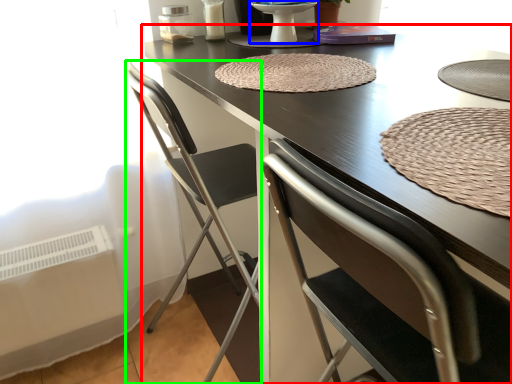
Question: Which is nearer to the table (highlighted by a red box)? round table (highlighted by a blue box) or chair (highlighted by a green box).

Choices:
 (A) round table
 (B) chair

Answer: (B)